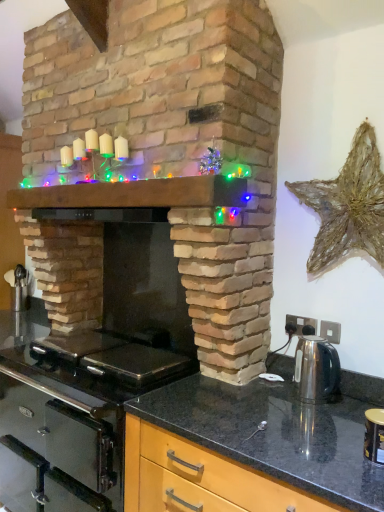
Question: In terms of height, does black glass gas stove at lower left look taller or shorter compared to matte black countertop at lower right?

Choices:
 (A) short
 (B) tall

Answer: (A)

Question: Is black glass gas stove at lower left in front of or behind matte black countertop at lower right in the image?

Choices:
 (A) behind
 (B) front

Answer: (A)

Question: Which object is positioned farthest from the brick fireplace at center?

Choices:
 (A) black glass gas stove at lower left
 (B) matte black countertop at lower right
 (C) wooden mantel at center
 (D) satin silver kettle at right

Answer: (B)

Question: Which is nearer to the brick fireplace at center?

Choices:
 (A) wooden mantel at center
 (B) black glass gas stove at lower left
 (C) matte black countertop at lower right
 (D) satin silver kettle at right

Answer: (A)